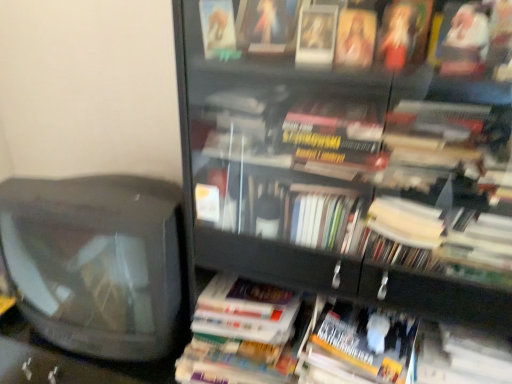
Question: Should I look upward or downward to see hardcover book at center, positioned as the 1th paperback book in left-to-right order?

Choices:
 (A) up
 (B) down

Answer: (B)

Question: Is transparent glass bookcase at center smaller than hardcover book at center, positioned as the 1th paperback book in left-to-right order?

Choices:
 (A) no
 (B) yes

Answer: (A)

Question: Does transparent glass bookcase at center have a lesser height compared to hardcover book at center, positioned as the 1th paperback book in left-to-right order?

Choices:
 (A) yes
 (B) no

Answer: (B)

Question: From a real-world perspective, is transparent glass bookcase at center over hardcover book at center, positioned as the 1th paperback book in left-to-right order?

Choices:
 (A) yes
 (B) no

Answer: (A)

Question: Is transparent glass bookcase at center facing towards hardcover book at center, arranged as the 2th paperback book when viewed from the right?

Choices:
 (A) no
 (B) yes

Answer: (B)

Question: Does transparent glass bookcase at center have a lesser width compared to hardcover book at center, positioned as the 1th paperback book in left-to-right order?

Choices:
 (A) no
 (B) yes

Answer: (A)

Question: Is transparent glass bookcase at center taller than hardcover book at center, arranged as the 2th paperback book when viewed from the right?

Choices:
 (A) yes
 (B) no

Answer: (A)

Question: Is yellow matte paperback book at lower right, which appears as the first paperback book when viewed from the right, bigger than hardcover book at center, arranged as the 2th paperback book when viewed from the right?

Choices:
 (A) no
 (B) yes

Answer: (A)

Question: Does yellow matte paperback book at lower right, which appears as the first paperback book when viewed from the right, turn towards hardcover book at center, arranged as the 2th paperback book when viewed from the right?

Choices:
 (A) yes
 (B) no

Answer: (B)

Question: Is yellow matte paperback book at lower right, which appears as the first paperback book when viewed from the right, shorter than hardcover book at center, positioned as the 1th paperback book in left-to-right order?

Choices:
 (A) no
 (B) yes

Answer: (A)

Question: From a real-world perspective, does yellow matte paperback book at lower right, which is the 2th paperback book from left to right, stand above hardcover book at center, arranged as the 2th paperback book when viewed from the right?

Choices:
 (A) no
 (B) yes

Answer: (A)

Question: Considering the relative sizes of yellow matte paperback book at lower right, which is the 2th paperback book from left to right, and hardcover book at center, arranged as the 2th paperback book when viewed from the right, in the image provided, is yellow matte paperback book at lower right, which is the 2th paperback book from left to right, thinner than hardcover book at center, arranged as the 2th paperback book when viewed from the right,?

Choices:
 (A) yes
 (B) no

Answer: (A)

Question: Is yellow matte paperback book at lower right, which appears as the first paperback book when viewed from the right, at the right side of hardcover book at center, positioned as the 1th paperback book in left-to-right order?

Choices:
 (A) yes
 (B) no

Answer: (A)

Question: Can you confirm if transparent glass bookcase at center is thinner than yellow matte paperback book at lower right, which is the 2th paperback book from left to right?

Choices:
 (A) yes
 (B) no

Answer: (B)